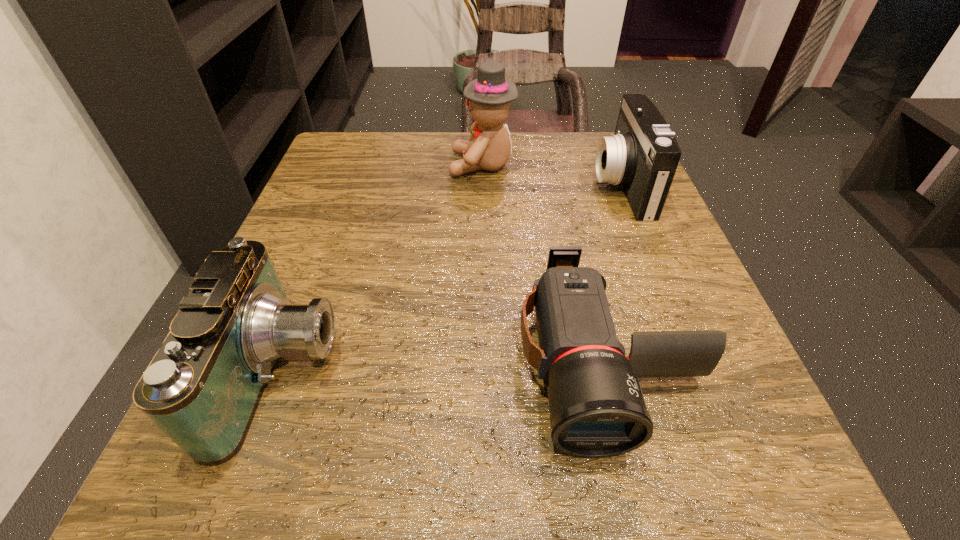
Where is `unoccupied position between the leftmost camcorder and the farthest camcorder`? unoccupied position between the leftmost camcorder and the farthest camcorder is located at coordinates pyautogui.click(x=451, y=279).

Where is `blank region between the tallest object and the leftmost object`? The image size is (960, 540). blank region between the tallest object and the leftmost object is located at coordinates (381, 269).

Select which object is the third closest to the shortest camcorder. Please provide its 2D coordinates. Your answer should be formatted as a tuple, i.e. [(x, y)], where the tuple contains the x and y coordinates of a point satisfying the conditions above.

[(488, 97)]

Identify the location of object identified as the second closest to the leftmost object. This screenshot has height=540, width=960. point(488,97).

Where is `camcorder identified as the closest to the leftmost object`? camcorder identified as the closest to the leftmost object is located at coordinates (597, 409).

You are a GUI agent. You are given a task and a screenshot of the screen. Output one action in this format:
    pyautogui.click(x=<x>, y=<y>)
    Task: Click on the closest camcorder to the tallest object
    This screenshot has height=540, width=960.
    Given the screenshot: What is the action you would take?
    pyautogui.click(x=643, y=154)

The height and width of the screenshot is (540, 960). I want to click on free space that satisfies the following two spatial constraints: 1. on the lens of the shortest object; 2. on the front-facing side of the leftmost camcorder, so click(610, 373).

Where is `vacant area that satisfies the following two spatial constraints: 1. on the lens of the shortest camcorder; 2. on the front-facing side of the leftmost object`? The height and width of the screenshot is (540, 960). vacant area that satisfies the following two spatial constraints: 1. on the lens of the shortest camcorder; 2. on the front-facing side of the leftmost object is located at coordinates (610, 373).

Find the location of `free point that satisfies the following two spatial constraints: 1. on the lens of the farthest camcorder; 2. on the lens of the shortest object`. free point that satisfies the following two spatial constraints: 1. on the lens of the farthest camcorder; 2. on the lens of the shortest object is located at coordinates (692, 360).

This screenshot has height=540, width=960. Find the location of `free point that satisfies the following two spatial constraints: 1. on the lens of the farthest camcorder; 2. on the lens of the shortest camcorder`. free point that satisfies the following two spatial constraints: 1. on the lens of the farthest camcorder; 2. on the lens of the shortest camcorder is located at coordinates (692, 360).